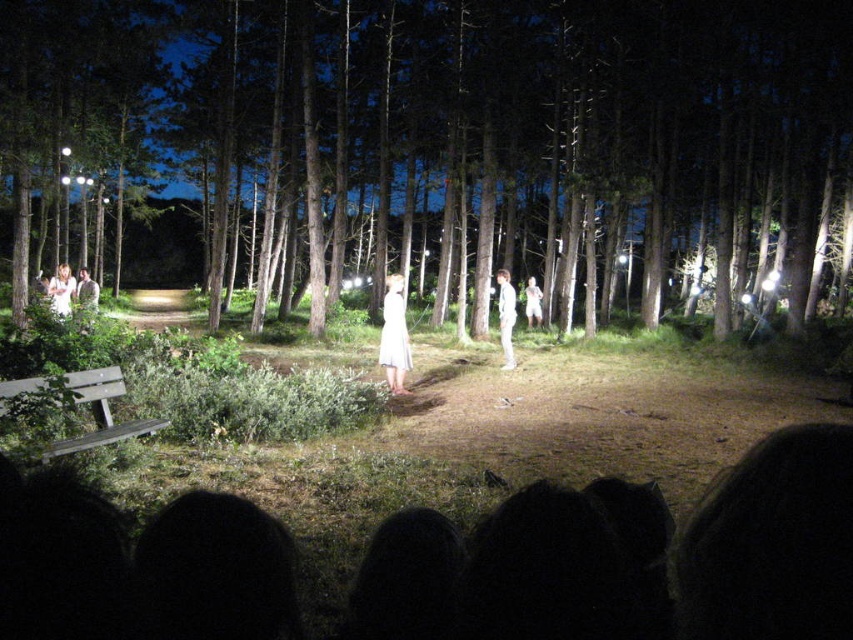
Question: Which object is closer to the camera taking this photo?

Choices:
 (A) white cotton dress at left
 (B) white dress at left

Answer: (B)

Question: Is brown wood tree at center below white cotton dress at center?

Choices:
 (A) yes
 (B) no

Answer: (B)

Question: Does white cotton dress at left have a greater width compared to white cotton dress at center?

Choices:
 (A) yes
 (B) no

Answer: (A)

Question: Which object is the closest to the white fabric dress at center?

Choices:
 (A) white satin dress at center
 (B) wooden bench at lower left

Answer: (A)

Question: Where is brown wood tree at center located in relation to white cotton dress at left in the image?

Choices:
 (A) right
 (B) left

Answer: (A)

Question: Which object is the closest to the white fabric dress at center?

Choices:
 (A) wooden bench at lower left
 (B) white satin dress at center
 (C) white cotton dress at left
 (D) white cotton dress at center

Answer: (B)